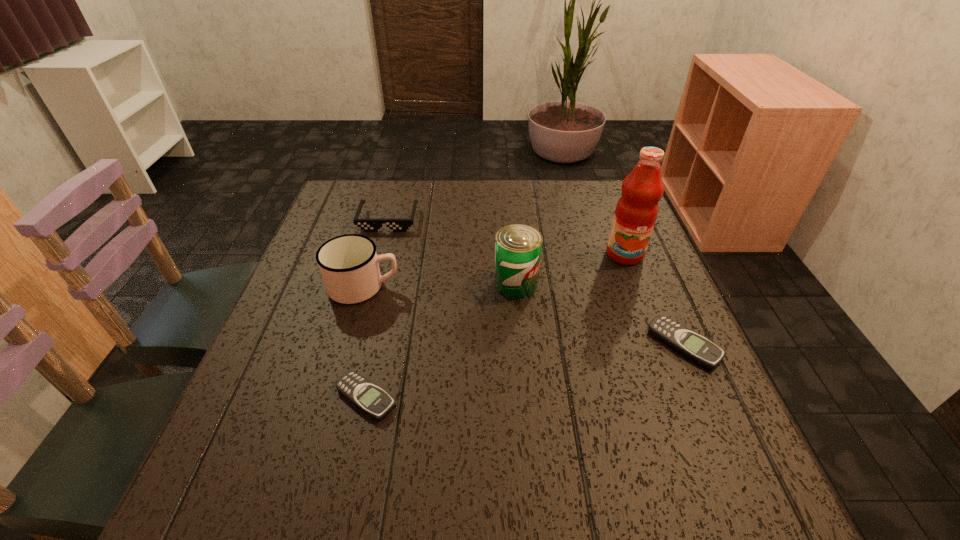
Find the location of a particular element. Image resolution: width=960 pixels, height=540 pixels. mug at the left edge is located at coordinates (349, 266).

The image size is (960, 540). I want to click on beeper situated at the right edge, so click(x=688, y=343).

Where is `fruit juice at the right edge`? fruit juice at the right edge is located at coordinates (636, 211).

The width and height of the screenshot is (960, 540). I want to click on object that is at the far left corner, so click(x=368, y=225).

The image size is (960, 540). In the image, there is a desktop. Identify the location of vacant space at the far edge. (564, 187).

In order to click on vacant space at the near edge of the desktop in this screenshot , I will do `click(607, 423)`.

Locate an element on the screen. This screenshot has height=540, width=960. free space at the left edge of the desktop is located at coordinates click(x=296, y=307).

In order to click on free space at the right edge of the desktop in this screenshot , I will do `click(651, 301)`.

I want to click on vacant space at the far left corner of the desktop, so click(383, 198).

Image resolution: width=960 pixels, height=540 pixels. I want to click on vacant space at the far right corner, so click(595, 216).